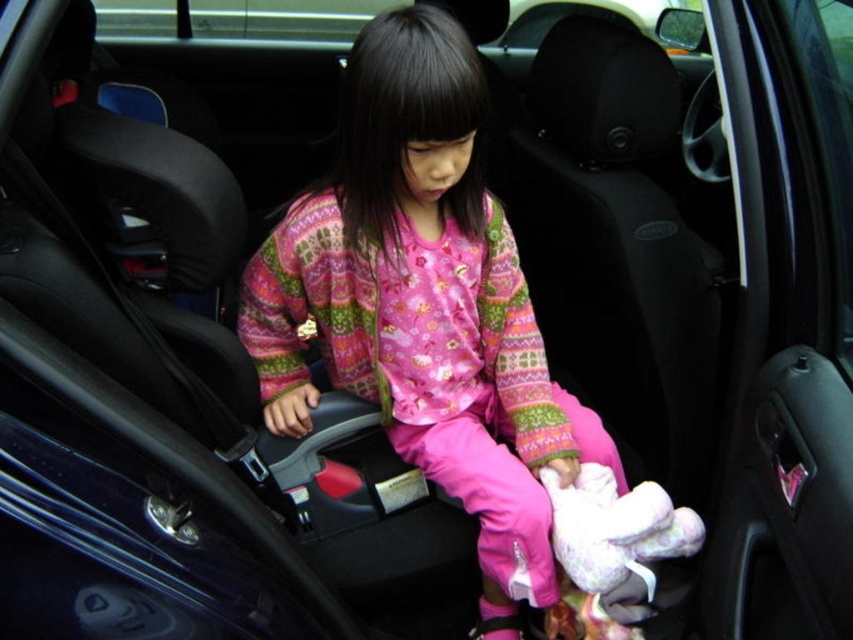
Question: Which of the following is the closest to the observer?

Choices:
 (A) white plush toy at center
 (B) pink fabric pajamas at center

Answer: (B)

Question: Is pink fabric pajamas at center positioned before white plush toy at center?

Choices:
 (A) yes
 (B) no

Answer: (A)

Question: Is pink fabric pajamas at center above white plush toy at center?

Choices:
 (A) no
 (B) yes

Answer: (B)

Question: Which point is closer to the camera?

Choices:
 (A) white plush toy at center
 (B) pink fabric pajamas at center

Answer: (B)

Question: Is pink fabric pajamas at center thinner than white plush toy at center?

Choices:
 (A) yes
 (B) no

Answer: (B)

Question: Which point is farther to the camera?

Choices:
 (A) (572, 564)
 (B) (355, 388)

Answer: (B)